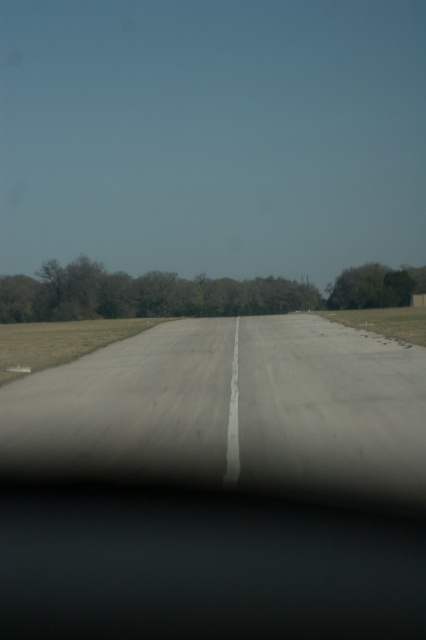
Question: Is gray asphalt runway at center smaller than green leafy trees at center?

Choices:
 (A) no
 (B) yes

Answer: (B)

Question: Based on their relative distances, which object is nearer to the green leafy tree at right?

Choices:
 (A) gray asphalt runway at center
 (B) green leafy trees at center

Answer: (B)

Question: Which object is positioned farthest from the gray asphalt runway at center?

Choices:
 (A) green leafy tree at right
 (B) green leafy trees at center

Answer: (A)

Question: Is green leafy trees at center closer to the viewer compared to green leafy tree at right?

Choices:
 (A) yes
 (B) no

Answer: (A)

Question: Is gray asphalt runway at center smaller than green leafy tree at right?

Choices:
 (A) yes
 (B) no

Answer: (A)

Question: Which point is closer to the camera?

Choices:
 (A) (92, 289)
 (B) (238, 353)
 (C) (382, 268)

Answer: (B)